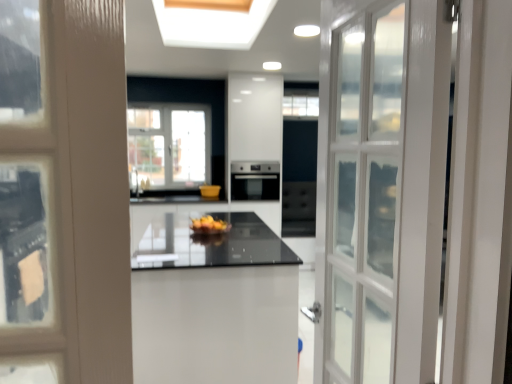
Question: From the image's perspective, relative to yellow matte bowl at center, is satin black oven at center above or below?

Choices:
 (A) below
 (B) above

Answer: (B)

Question: Is satin black oven at center in front of or behind yellow matte bowl at center in the image?

Choices:
 (A) behind
 (B) front

Answer: (A)

Question: Estimate the real-world distances between objects in this image. Which object is farther from the white glossy table at center?

Choices:
 (A) satin black oven at center
 (B) yellow matte bowl at center

Answer: (A)

Question: Which object is the closest to the yellow matte bowl at center?

Choices:
 (A) white glossy table at center
 (B) satin black oven at center

Answer: (A)